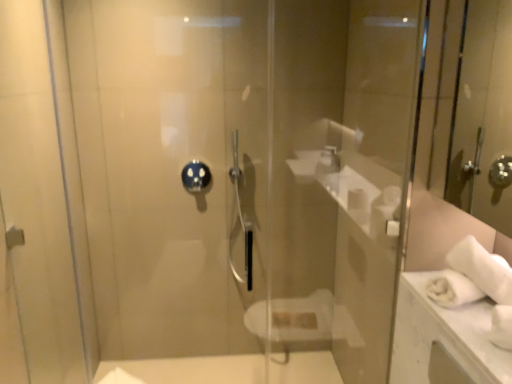
Question: Is blue glossy showerhead at center wider or thinner than transparent glass door at center?

Choices:
 (A) wide
 (B) thin

Answer: (B)

Question: In terms of size, does blue glossy showerhead at center appear bigger or smaller than transparent glass door at center?

Choices:
 (A) small
 (B) big

Answer: (A)

Question: Considering the real-world distances, which object is closest to the transparent glass screen door at left?

Choices:
 (A) transparent glass door at center
 (B) blue glossy showerhead at center

Answer: (B)

Question: Considering the real-world distances, which object is farthest from the transparent glass door at center?

Choices:
 (A) transparent glass screen door at left
 (B) blue glossy showerhead at center

Answer: (A)